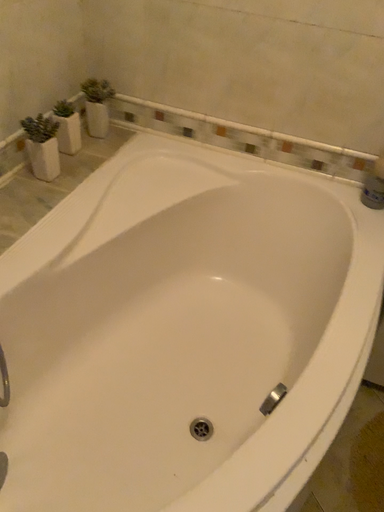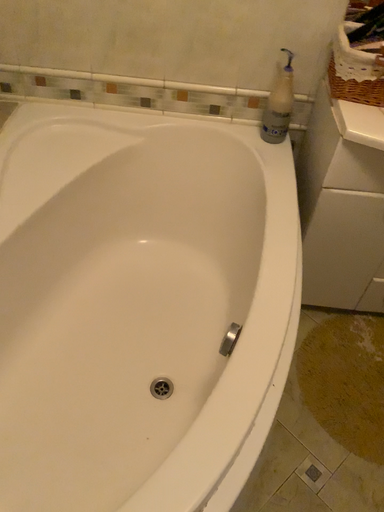
Question: How did the camera likely rotate when shooting the video?

Choices:
 (A) rotated left
 (B) rotated right

Answer: (B)